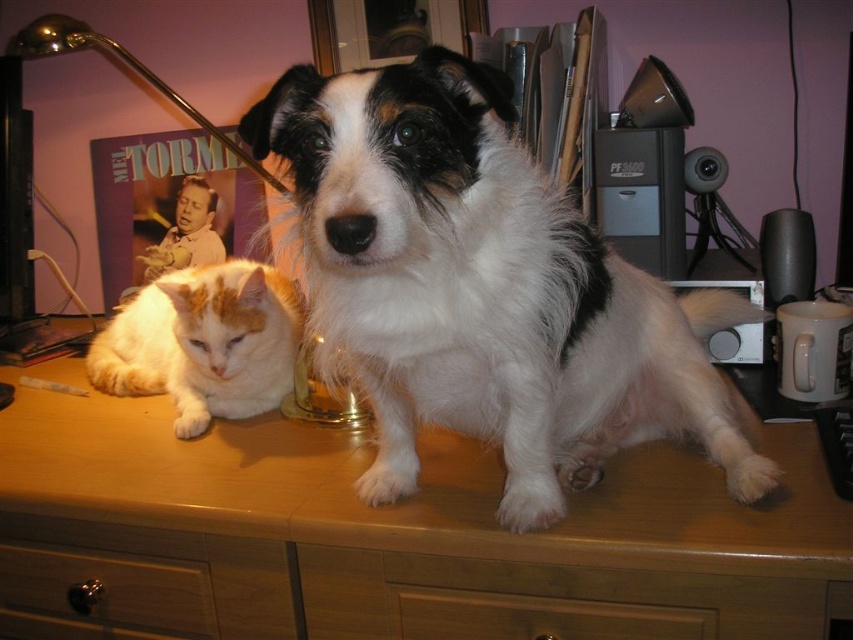
Question: Can you confirm if orange-white fur cat at left is positioned to the right of metallic brass drawer at lower left?

Choices:
 (A) yes
 (B) no

Answer: (B)

Question: Is the position of orange-white fur cat at left more distant than that of metallic brass drawer at lower left?

Choices:
 (A) yes
 (B) no

Answer: (A)

Question: Is white fluffy dog at center to the right of orange-white fur cat at left from the viewer's perspective?

Choices:
 (A) no
 (B) yes

Answer: (B)

Question: Which is farther from the metallic brass drawer at lower left?

Choices:
 (A) white fluffy dog at center
 (B) orange-white fur cat at left

Answer: (A)

Question: Which of the following is the farthest from the observer?

Choices:
 (A) 331,605
 (B) 397,180

Answer: (A)

Question: Estimate the real-world distances between objects in this image. Which object is farther from the orange-white fur cat at left?

Choices:
 (A) wooden at center
 (B) metallic brass drawer at lower left

Answer: (B)